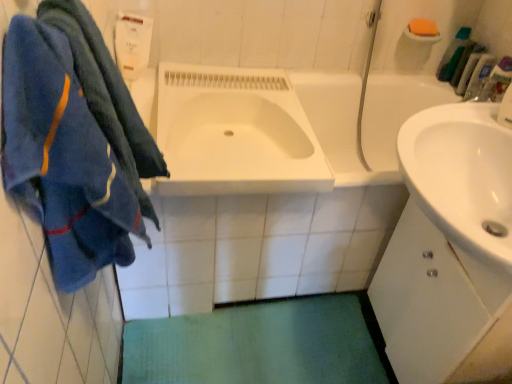
Question: Considering the positions of blue fuzzy towel at left and white glossy sink at center in the image, is blue fuzzy towel at left taller or shorter than white glossy sink at center?

Choices:
 (A) tall
 (B) short

Answer: (A)

Question: Is blue fuzzy towel at left inside the boundaries of white glossy sink at center, or outside?

Choices:
 (A) outside
 (B) inside

Answer: (A)

Question: Based on their relative distances, which object is farther from the orange sponge at upper right?

Choices:
 (A) white glossy sink at center
 (B) green fabric bath mat at lower center
 (C) blue fuzzy towel at left
 (D) green plastic toothbrush at upper right, marked as the first toiletry in a top-to-bottom arrangement
 (E) clear plastic bottle at upper right, the third toiletry positioned from the top

Answer: (C)

Question: Which is farther from the orange sponge at upper right?

Choices:
 (A) green fabric bath mat at lower center
 (B) green plastic toothbrush at upper right, positioned as the third toiletry in bottom-to-top order
 (C) white matte cabinet at right
 (D) white glossy sink at center
 (E) clear plastic bottle at upper right, marked as the 1th toiletry in a bottom-to-top arrangement

Answer: (A)